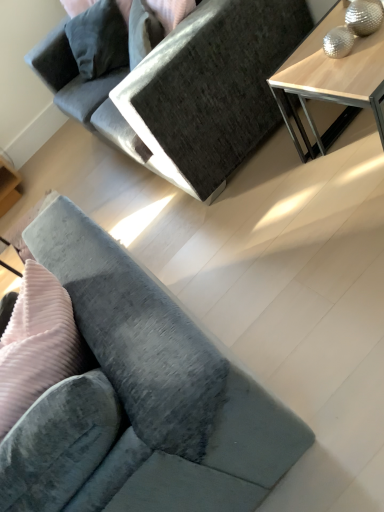
Image resolution: width=384 pixels, height=512 pixels. I want to click on vacant area on top of light wood table at upper right (from a real-world perspective), so click(x=342, y=55).